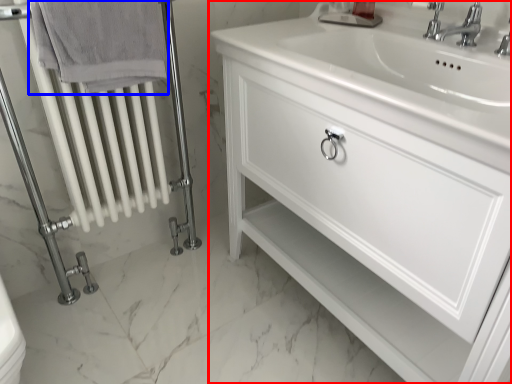
Question: Among these objects, which one is nearest to the camera, bathroom cabinet (highlighted by a red box) or bath towel (highlighted by a blue box)?

Choices:
 (A) bathroom cabinet
 (B) bath towel

Answer: (A)